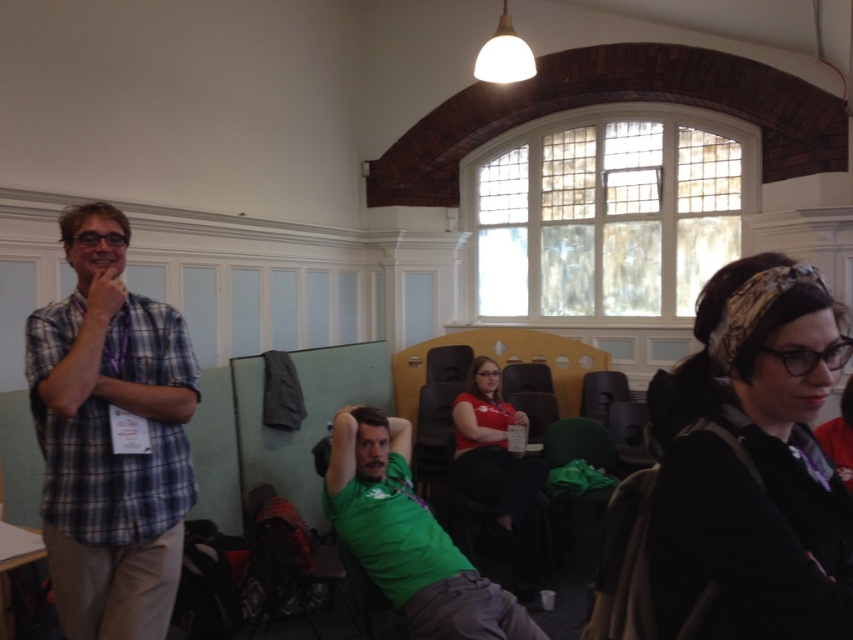
Find the location of `green matte shirt at center`. green matte shirt at center is located at coordinates (408, 536).

Who is taller, green matte shirt at center or matte red shirt at center?

matte red shirt at center

Identify the location of green matte shirt at center. (408, 536).

Between black fabric headband at upper right and matte black chair at center, which one has less height?

matte black chair at center

Does black fabric headband at upper right come in front of matte black chair at center?

Yes, black fabric headband at upper right is in front of matte black chair at center.

Who is more distant from viewer, (730, 616) or (599, 406)?

Positioned behind is point (599, 406).

Where is `black fabric headband at upper right`? black fabric headband at upper right is located at coordinates [753, 464].

Who is more distant from viewer, (181, 502) or (387, 426)?

The point (387, 426) is more distant.

This screenshot has width=853, height=640. Describe the element at coordinates (109, 436) in the screenshot. I see `plaid shirt at left` at that location.

Where is `plaid shirt at left`? The height and width of the screenshot is (640, 853). plaid shirt at left is located at coordinates (109, 436).